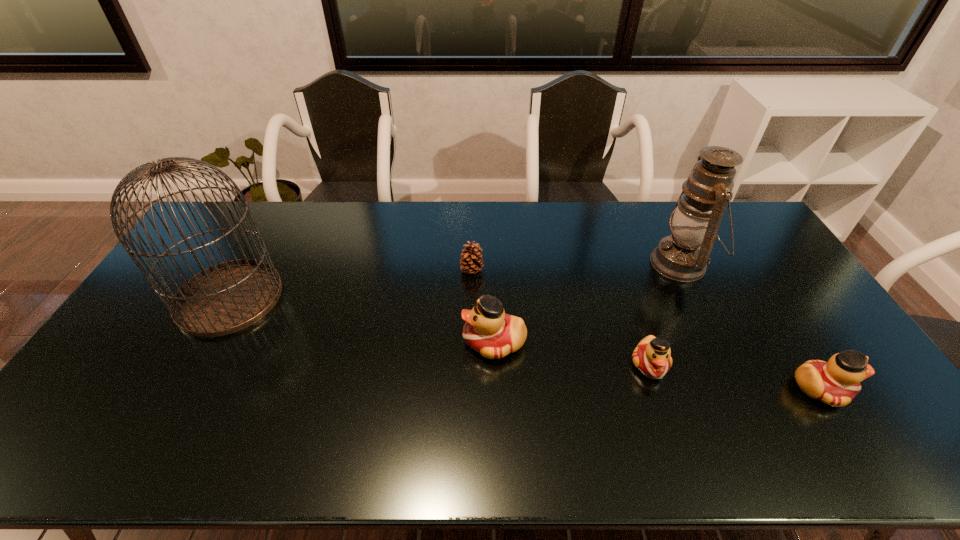
What are the coordinates of `object present at the right edge` in the screenshot? It's located at (836, 382).

Where is `object that is at the near right corner`? The image size is (960, 540). object that is at the near right corner is located at coordinates (836, 382).

Find the location of a particular element. vacant space at the far edge is located at coordinates (612, 213).

The height and width of the screenshot is (540, 960). In the image, there is a desktop. Find the location of `free space at the near edge`. free space at the near edge is located at coordinates (180, 414).

The width and height of the screenshot is (960, 540). In the image, there is a desktop. Find the location of `blank space at the left edge`. blank space at the left edge is located at coordinates (128, 352).

In the image, there is a desktop. Where is `vacant space at the right edge`? The width and height of the screenshot is (960, 540). vacant space at the right edge is located at coordinates (771, 303).

In order to click on free space at the far right corner of the desktop in this screenshot , I will do `click(746, 227)`.

You are a GUI agent. You are given a task and a screenshot of the screen. Output one action in this format:
    pyautogui.click(x=<x>, y=<y>)
    Task: Click on the vacant space at the near right corner of the desktop
    This screenshot has width=960, height=540.
    Given the screenshot: What is the action you would take?
    pyautogui.click(x=878, y=400)

You are a GUI agent. You are given a task and a screenshot of the screen. Output one action in this format:
    pyautogui.click(x=<x>, y=<y>)
    Task: Click on the vacant space in between the birdcage and the shortest duck
    This screenshot has height=540, width=960.
    Given the screenshot: What is the action you would take?
    pyautogui.click(x=440, y=331)

At what (x,y) coordinates should I click in order to perform the action: click on vacant space that is in between the oil lamp and the leftmost object. Please return your answer as a coordinate pair (x, y). The width and height of the screenshot is (960, 540). Looking at the image, I should click on (455, 281).